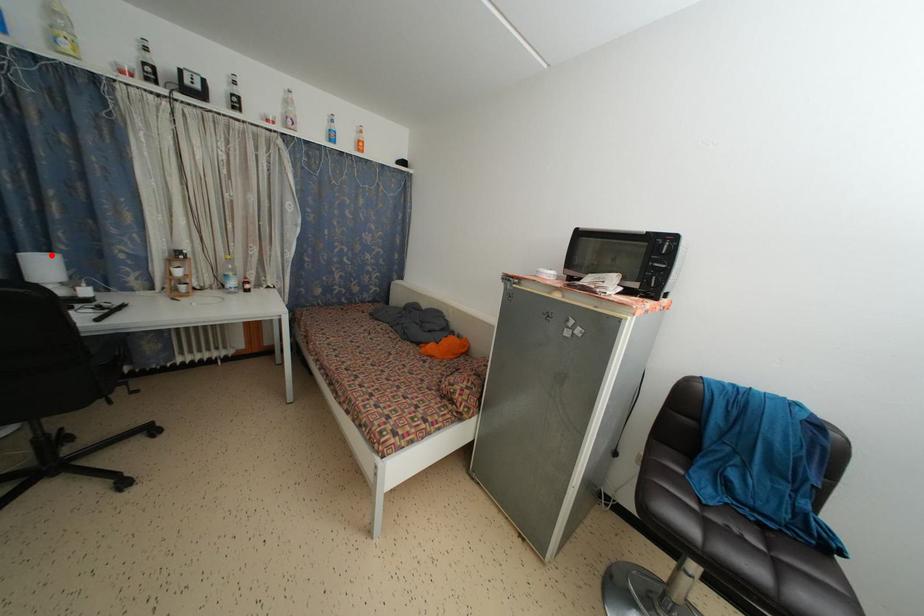
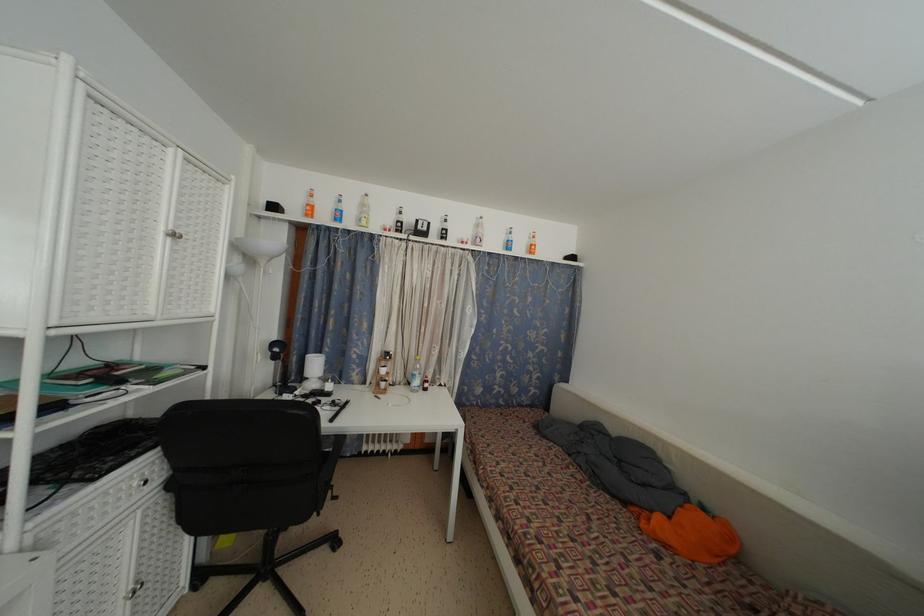
Where in the second image is the point corresponding to the highlighted location from the first image?

(323, 357)